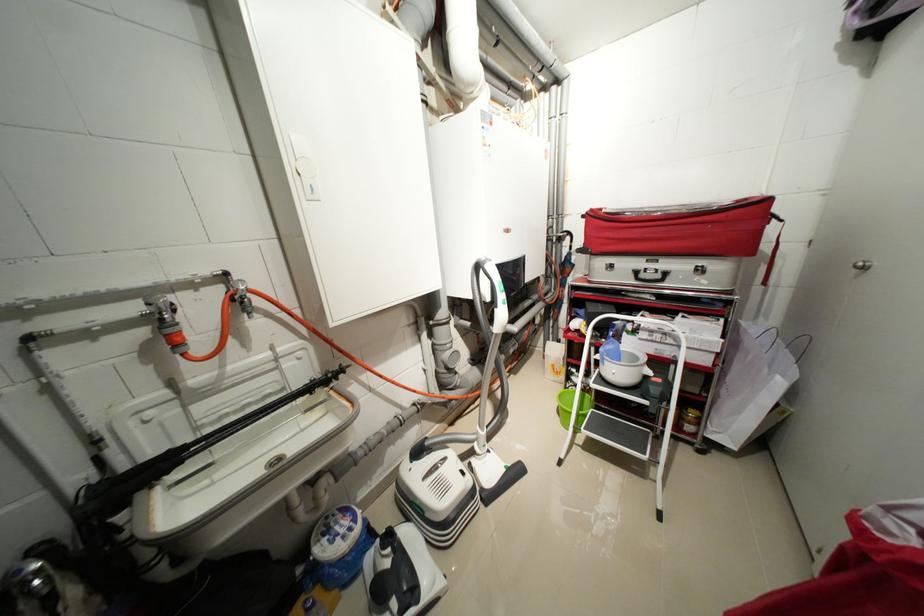
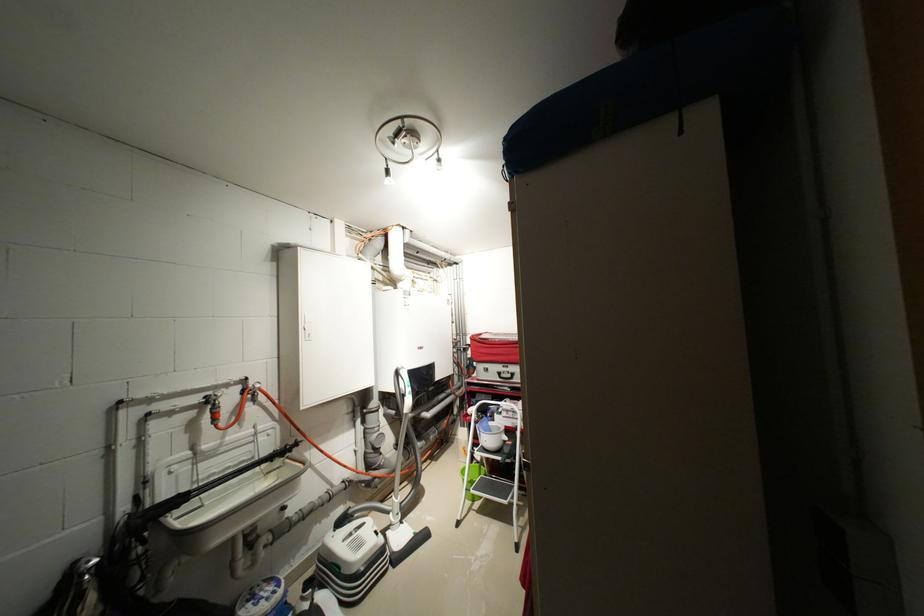
Find the pixel in the second image that matches point 302,363 in the first image.

(273, 439)